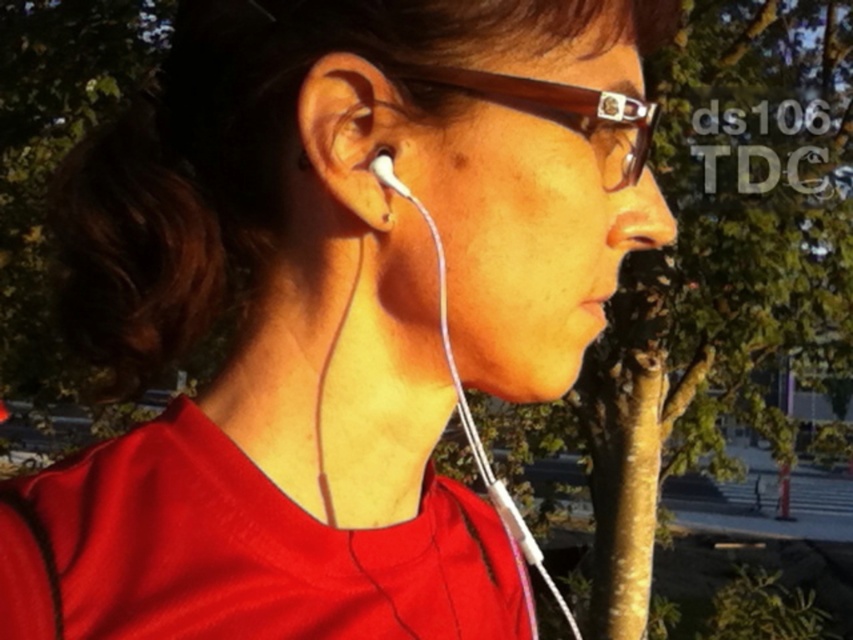
Who is lower down, brown textured tree trunk at center or matte white earbud at center?

brown textured tree trunk at center is lower down.

Is brown textured tree trunk at center positioned before matte white earbud at center?

No, brown textured tree trunk at center is behind matte white earbud at center.

This screenshot has width=853, height=640. What do you see at coordinates (720, 273) in the screenshot? I see `brown textured tree trunk at center` at bounding box center [720, 273].

Find the location of a particular element. This screenshot has width=853, height=640. brown textured tree trunk at center is located at coordinates (720, 273).

Does point (419, 65) come closer to viewer compared to point (376, 157)?

That is True.

Which is in front, point (593, 108) or point (387, 161)?

Point (387, 161) is more forward.

At what (x,y) coordinates should I click in order to perform the action: click on brown translucent glasses at upper center. Please return your answer as a coordinate pair (x, y). Looking at the image, I should click on (553, 106).

Between brown textured tree trunk at center and brown translucent glasses at upper center, which one has less height?

brown translucent glasses at upper center is shorter.

Is brown textured tree trunk at center wider than brown translucent glasses at upper center?

Yes.

Is point (784, 45) positioned in front of point (553, 84)?

No.

Where is `brown textured tree trunk at center`? The height and width of the screenshot is (640, 853). brown textured tree trunk at center is located at coordinates (720, 273).